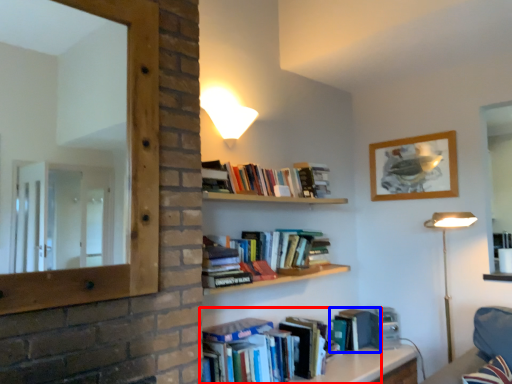
Question: Which object appears farthest to the camera in this image, book (highlighted by a red box) or paperback book (highlighted by a blue box)?

Choices:
 (A) book
 (B) paperback book

Answer: (B)